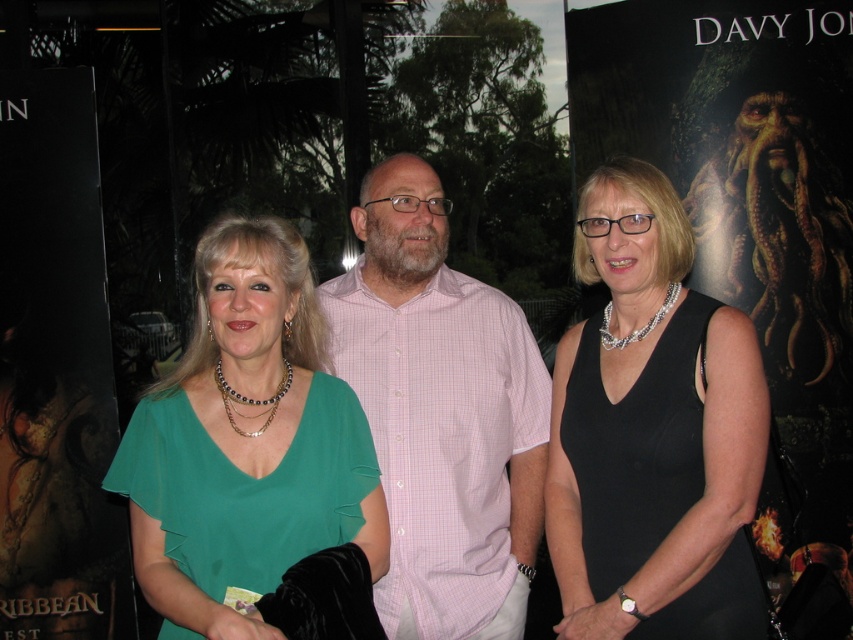
Question: Which object is the closest to the green chiffon blouse at center?

Choices:
 (A) black satin dress at center
 (B) pink checkered shirt at center

Answer: (B)

Question: Can you confirm if black satin dress at center is positioned above pink checkered shirt at center?

Choices:
 (A) yes
 (B) no

Answer: (A)

Question: Is black satin dress at center positioned behind pink checkered shirt at center?

Choices:
 (A) yes
 (B) no

Answer: (B)

Question: From the image, what is the correct spatial relationship of black satin dress at center in relation to pink checkered shirt at center?

Choices:
 (A) above
 (B) below

Answer: (A)

Question: Which of these objects is positioned farthest from the green chiffon blouse at center?

Choices:
 (A) pink checkered shirt at center
 (B) black satin dress at center

Answer: (B)

Question: Estimate the real-world distances between objects in this image. Which object is closer to the pink checkered shirt at center?

Choices:
 (A) green chiffon blouse at center
 (B) black satin dress at center

Answer: (A)